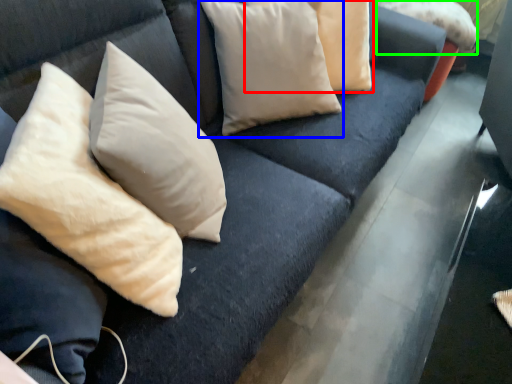
Question: Estimate the real-world distances between objects in this image. Which object is farther from pillow (highlighted by a red box), pillow (highlighted by a blue box) or pillow (highlighted by a green box)?

Choices:
 (A) pillow
 (B) pillow

Answer: (B)